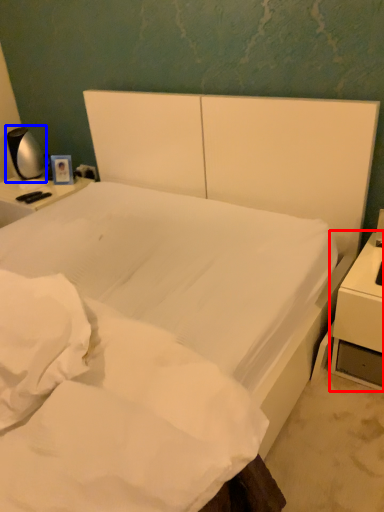
Question: Which object is closer to the camera taking this photo, nightstand (highlighted by a red box) or bedside lamp (highlighted by a blue box)?

Choices:
 (A) nightstand
 (B) bedside lamp

Answer: (A)